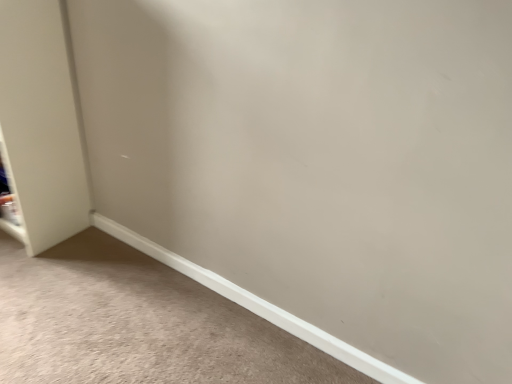
What is the approximate width of white matte door at lower left?

It is 11.98 inches.

At what (x,y) coordinates should I click in order to perform the action: click on white matte door at lower left. Please return your answer as a coordinate pair (x, y). This screenshot has width=512, height=384. Looking at the image, I should click on (41, 125).

The height and width of the screenshot is (384, 512). What do you see at coordinates (41, 125) in the screenshot?
I see `white matte door at lower left` at bounding box center [41, 125].

Identify the location of white matte door at lower left. This screenshot has width=512, height=384. (41, 125).